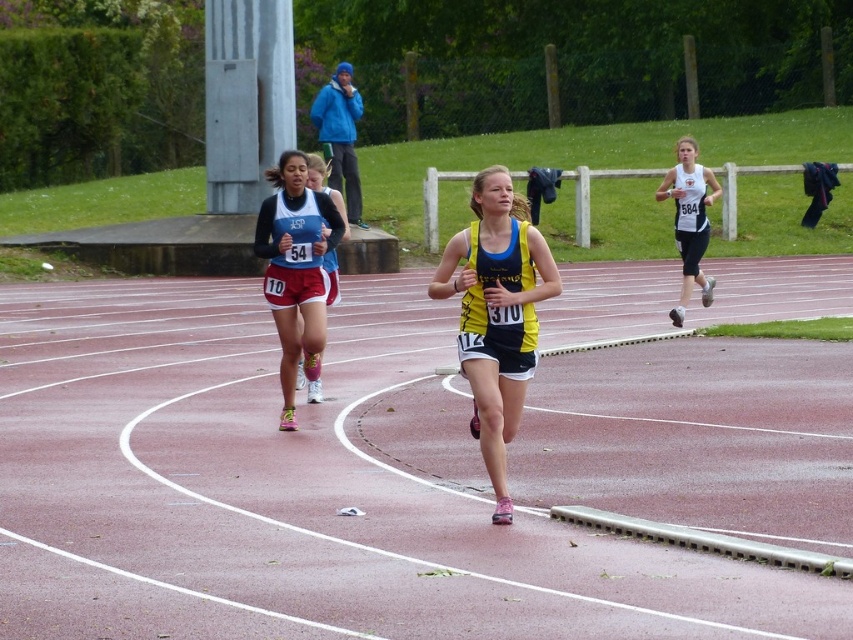
Question: Which point is closer to the camera?

Choices:
 (A) (688, 289)
 (B) (486, 352)
 (C) (816, 614)
 (D) (270, 244)

Answer: (C)

Question: Can you confirm if yellow fabric tank top at center is positioned above white athletic top at right?

Choices:
 (A) yes
 (B) no

Answer: (B)

Question: Does yellow fabric tank top at center have a larger size compared to white athletic top at right?

Choices:
 (A) no
 (B) yes

Answer: (A)

Question: Which of the following is the farthest from the observer?

Choices:
 (A) (628, 502)
 (B) (500, 225)

Answer: (A)

Question: Which object is closer to the camera taking this photo?

Choices:
 (A) rubberized red track at center
 (B) yellow fabric tank top at center
 (C) matte black shorts at center
 (D) white athletic top at right

Answer: (A)

Question: Can you confirm if rubberized red track at center is smaller than matte black shorts at center?

Choices:
 (A) no
 (B) yes

Answer: (A)